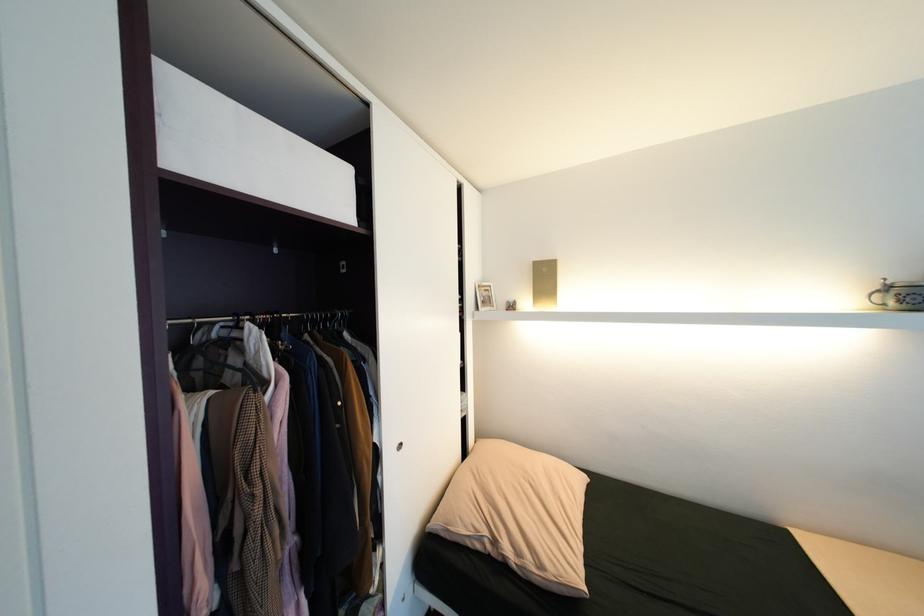
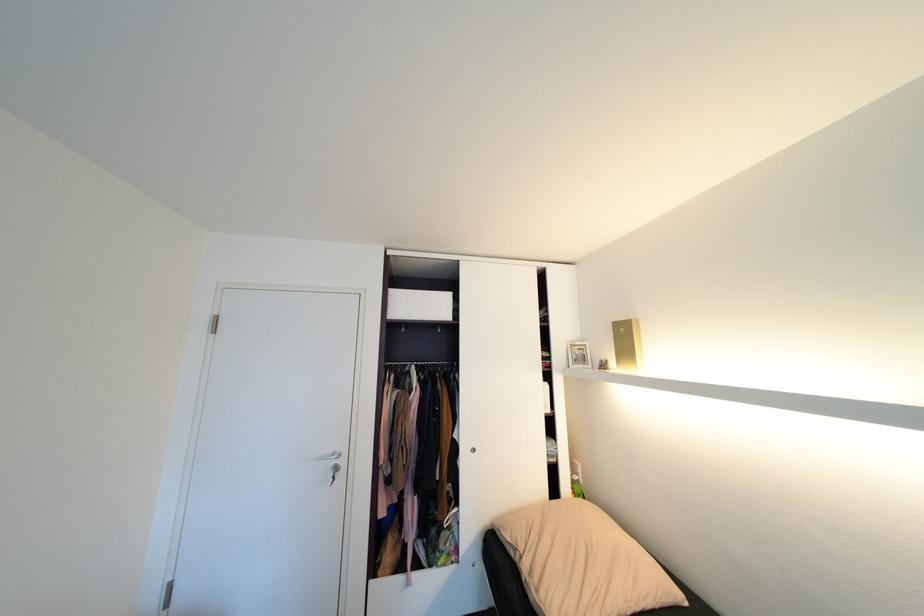
Locate, in the second image, the point that corresponds to point (407, 445) in the first image.

(481, 450)